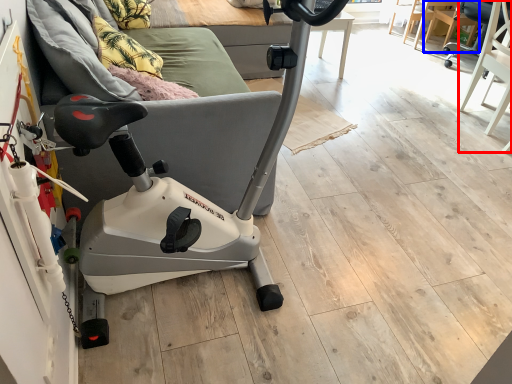
Question: Among these objects, which one is farthest to the camera, swivel chair (highlighted by a red box) or chair (highlighted by a blue box)?

Choices:
 (A) swivel chair
 (B) chair

Answer: (B)